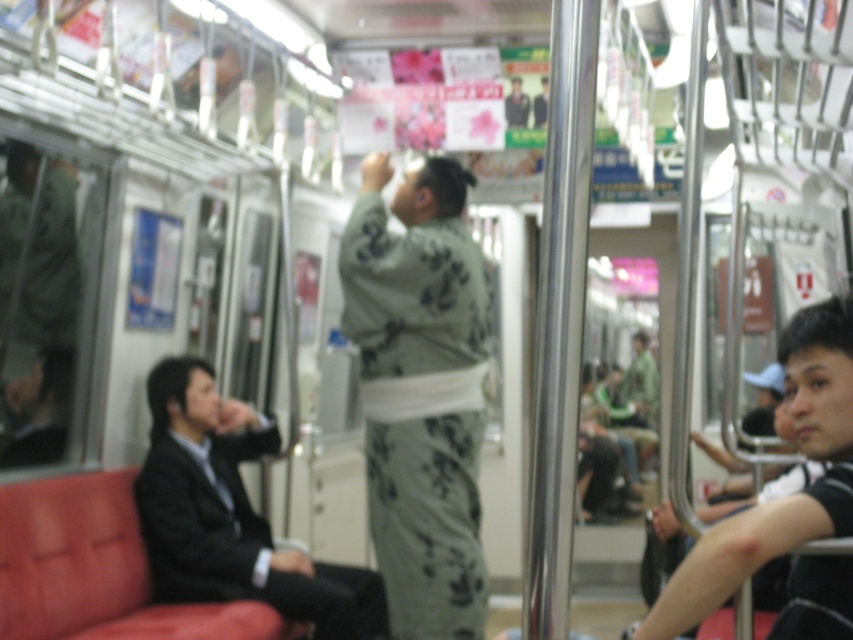
Who is positioned more to the right, light green kimono at center or matte black shirt at right?

From the viewer's perspective, matte black shirt at right appears more on the right side.

Between light green kimono at center and matte black shirt at right, which one has more height?

Standing taller between the two is light green kimono at center.

In the scene shown: Who is more distant from viewer, (x=361, y=321) or (x=848, y=524)?

The point (x=361, y=321) is behind.

Identify the location of light green kimono at center. The width and height of the screenshot is (853, 640). (421, 392).

Who is positioned more to the left, matte black shirt at right or dark blue uniform at center?

Positioned to the left is dark blue uniform at center.

This screenshot has height=640, width=853. Describe the element at coordinates (781, 497) in the screenshot. I see `matte black shirt at right` at that location.

Where is `matte black shirt at right`? Image resolution: width=853 pixels, height=640 pixels. matte black shirt at right is located at coordinates (781, 497).

Does point (437, 557) lie in front of point (524, 104)?

Yes, point (437, 557) is in front of point (524, 104).

What do you see at coordinates (421, 392) in the screenshot? I see `light green kimono at center` at bounding box center [421, 392].

Measure the distance between light green kimono at center and camera.

They are 3.03 meters apart.

Identify the location of light green kimono at center. The image size is (853, 640). (421, 392).